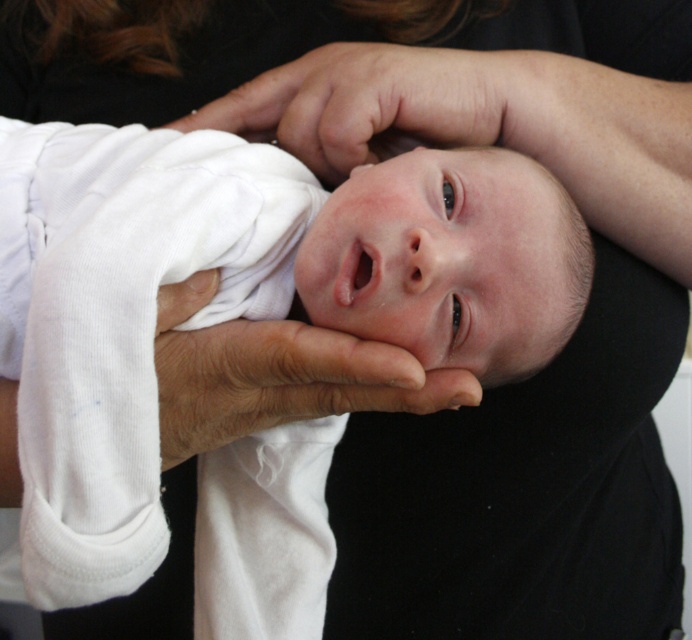
Who is taller, dry skin hand at center or smooth skin hand at center?

dry skin hand at center

Which is in front, point (156, 362) or point (400, 54)?

Point (156, 362) is more forward.

Find the location of a particular element. dry skin hand at center is located at coordinates (277, 374).

Identify the location of dry skin hand at center. (277, 374).